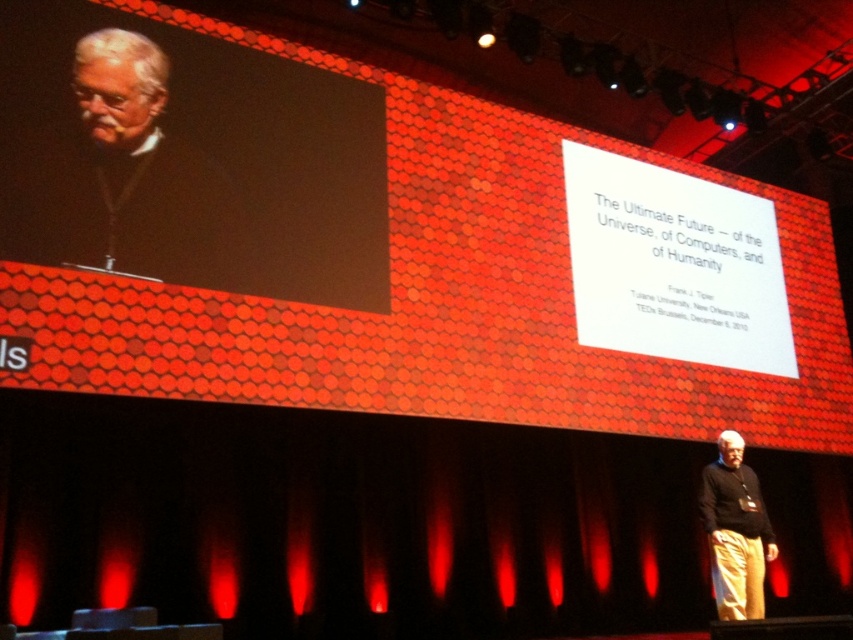
Question: Does matte black laptop at lower right appear under white paper at center?

Choices:
 (A) no
 (B) yes

Answer: (B)

Question: Which of the following is the closest to the observer?

Choices:
 (A) white paper at center
 (B) gray hair at left
 (C) black matte screen at upper left

Answer: (C)

Question: Among these points, which one is farthest from the camera?

Choices:
 (A) (161, 147)
 (B) (723, 556)
 (C) (730, 358)

Answer: (C)

Question: Which point is farther to the camera?

Choices:
 (A) black matte screen at upper left
 (B) gray hair at left

Answer: (B)

Question: Does white paper at center appear under black sweater at center?

Choices:
 (A) no
 (B) yes

Answer: (A)

Question: Can you confirm if black matte screen at upper left is bigger than gray hair at left?

Choices:
 (A) no
 (B) yes

Answer: (B)